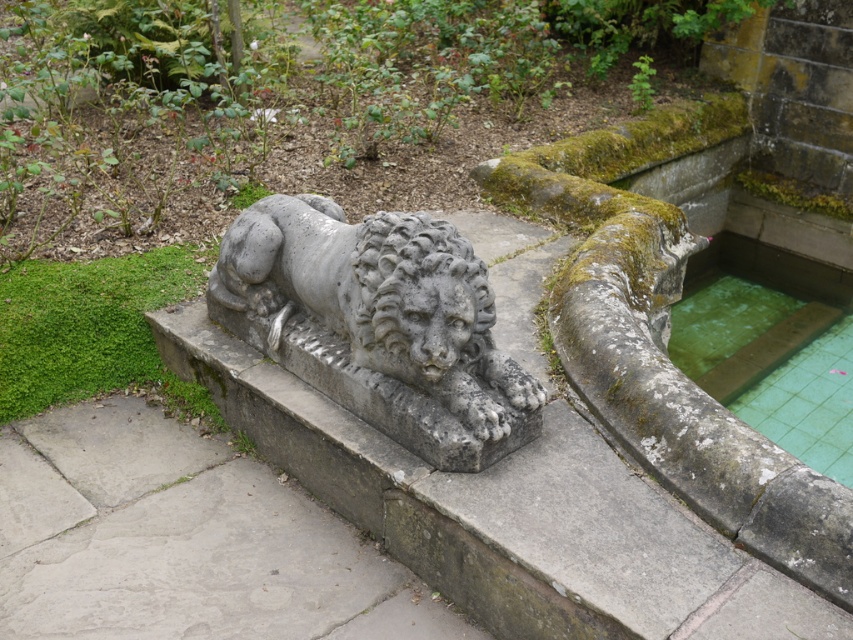
Which of these two, gray stone lion at center or green tiled water at right, stands taller?

green tiled water at right

Between point (264, 221) and point (747, 244), which one is positioned in front?

Point (264, 221)

Where is `gray stone lion at center`? The image size is (853, 640). gray stone lion at center is located at coordinates (379, 298).